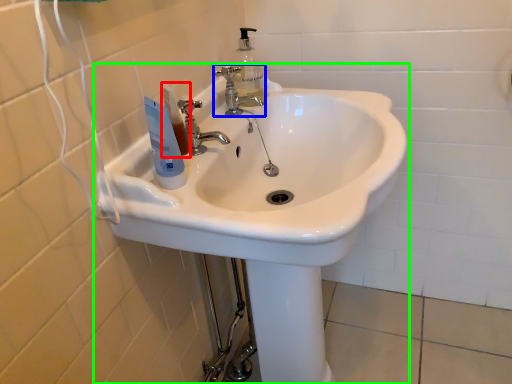
Question: Which object is positioned closest to toiletry (highlighted by a red box)? Select from tap (highlighted by a blue box) and sink (highlighted by a green box).

Choices:
 (A) tap
 (B) sink

Answer: (B)